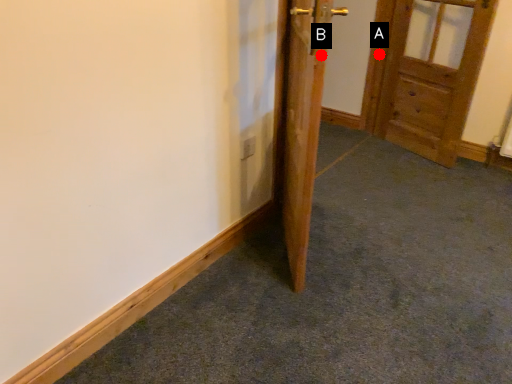
Question: Two points are circled on the image, labeled by A and B beside each circle. Which point is closer to the camera?

Choices:
 (A) A is closer
 (B) B is closer

Answer: (B)